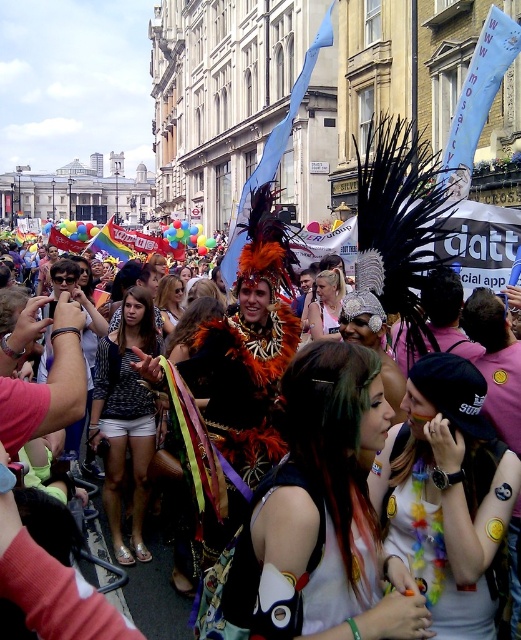
You are a photographer trying to capture both the multicolored sequined top at center and the shiny metallic top at center in the same frame. Based on their sizes, which one should you focus on to ensure both are visible without cropping?

The multicolored sequined top at center is larger in size than the shiny metallic top at center, so you should focus on the multicolored sequined top at center to ensure both are visible without cropping.

You are standing at the camera position observing the street scene. There is a point at coordinates point (33, 307). Can you tell me how far this point is from your current position?

The point at point (33, 307) is 177.33 feet away from the camera position.

You are a photographer trying to capture the vibrant costumes in the center of the scene. You notice two tops at the center of the image. Which one is closer to the camera, the multicolored sequined top at center or the shiny metallic top at center?

The multicolored sequined top at center is closer to the camera because it is in front of the shiny metallic top at center.